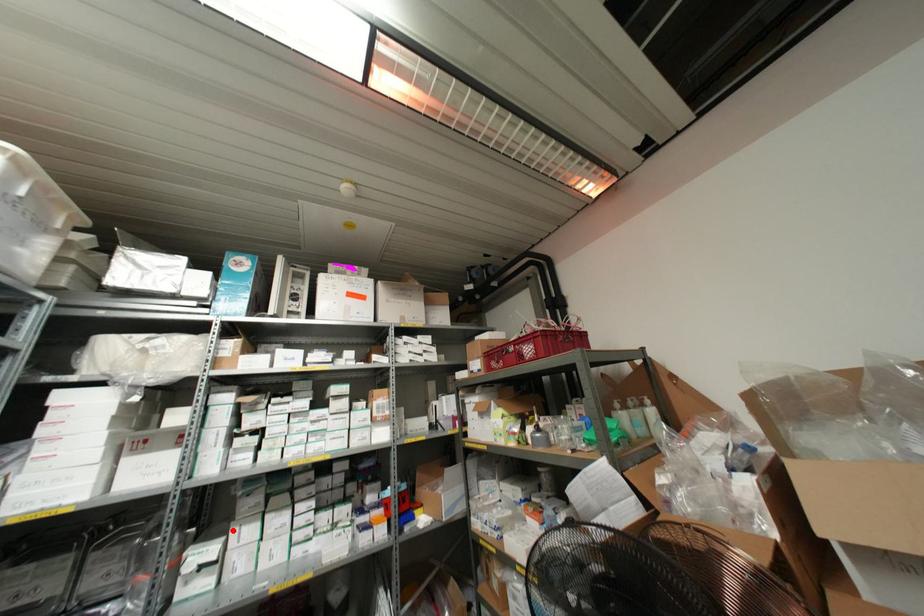
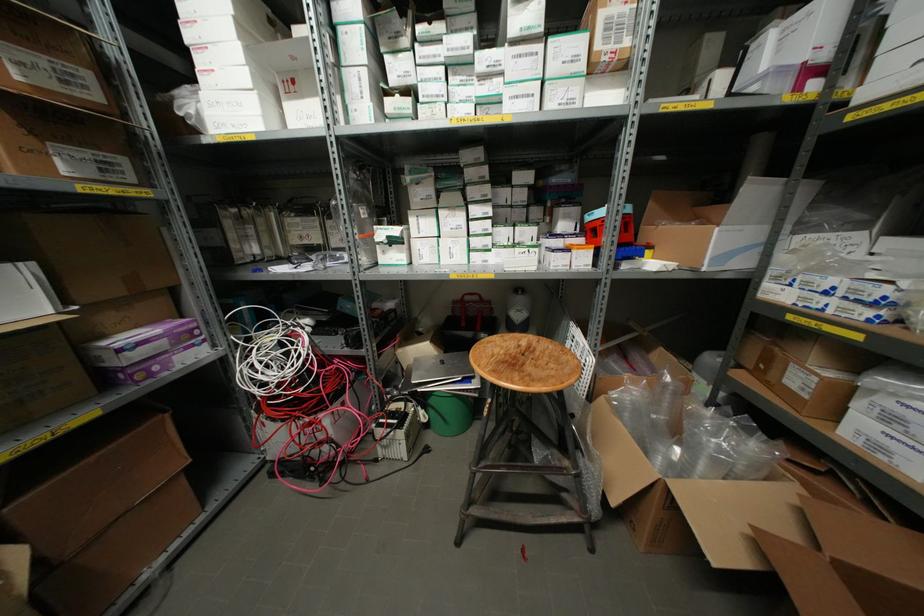
The point at the highlighted location is marked in the first image. Where is the corresponding point in the second image?

(410, 219)